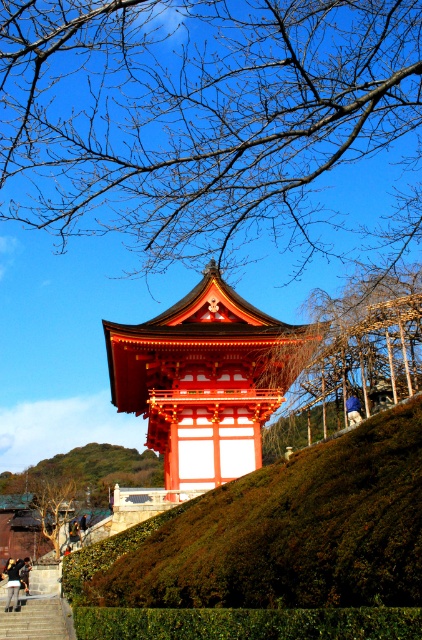
Question: Which point is closer to the camera taking this photo?

Choices:
 (A) (24, 612)
 (B) (408, 461)
 (C) (237, 380)
 (D) (351, 422)

Answer: (B)

Question: Among these points, which one is nearest to the camera?

Choices:
 (A) (27, 593)
 (B) (13, 577)

Answer: (A)

Question: Is green mossy hillside at lower center further to the viewer compared to shiny red wood tower at center?

Choices:
 (A) yes
 (B) no

Answer: (B)

Question: Does black leather jacket at center appear over dark blue jeans at lower left?

Choices:
 (A) no
 (B) yes

Answer: (B)

Question: Which point is closer to the camera taking this photo?

Choices:
 (A) (56, 620)
 (B) (29, 563)
 (C) (359, 420)

Answer: (A)

Question: Is bare branches at upper center positioned at the back of green mossy hillside at lower center?

Choices:
 (A) no
 (B) yes

Answer: (B)